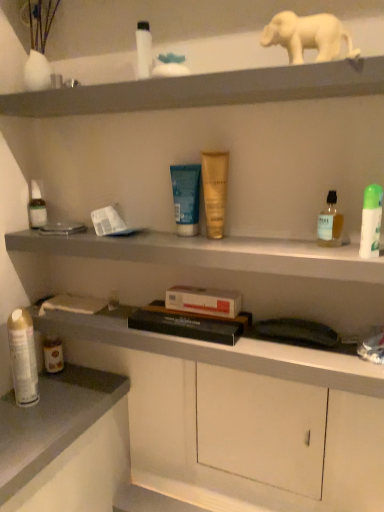
Locate an element on the screen. The width and height of the screenshot is (384, 512). vacant region in front of blue matte tube at center, the fourth toiletry positioned from the right is located at coordinates (203, 245).